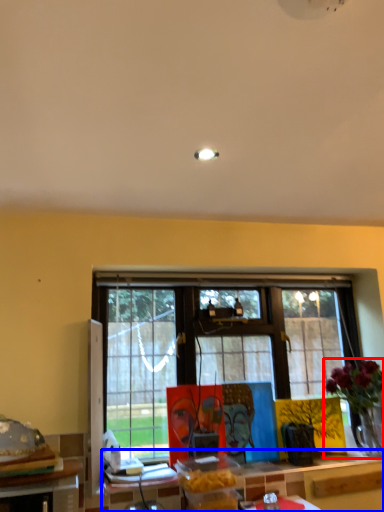
Question: Which object appears closest to the camera in this image, houseplant (highlighted by a red box) or table (highlighted by a blue box)?

Choices:
 (A) houseplant
 (B) table

Answer: (B)